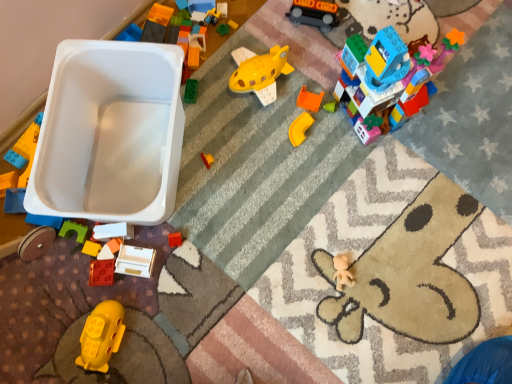
This screenshot has width=512, height=384. Find the location of `vacant point to the right of yellow matte plastic corner piece at center-right, acting as the sixth toy starting from the bottom`. vacant point to the right of yellow matte plastic corner piece at center-right, acting as the sixth toy starting from the bottom is located at coordinates (352, 146).